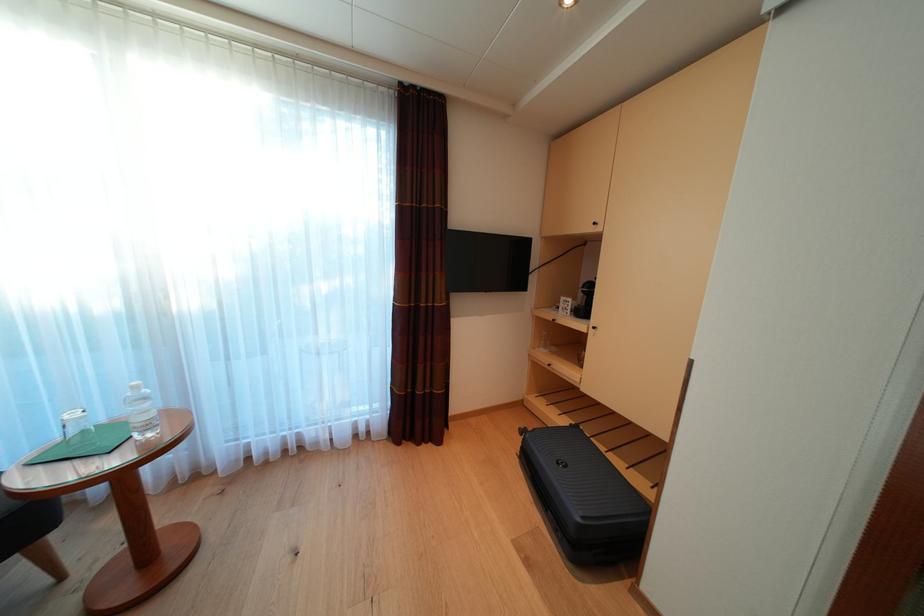
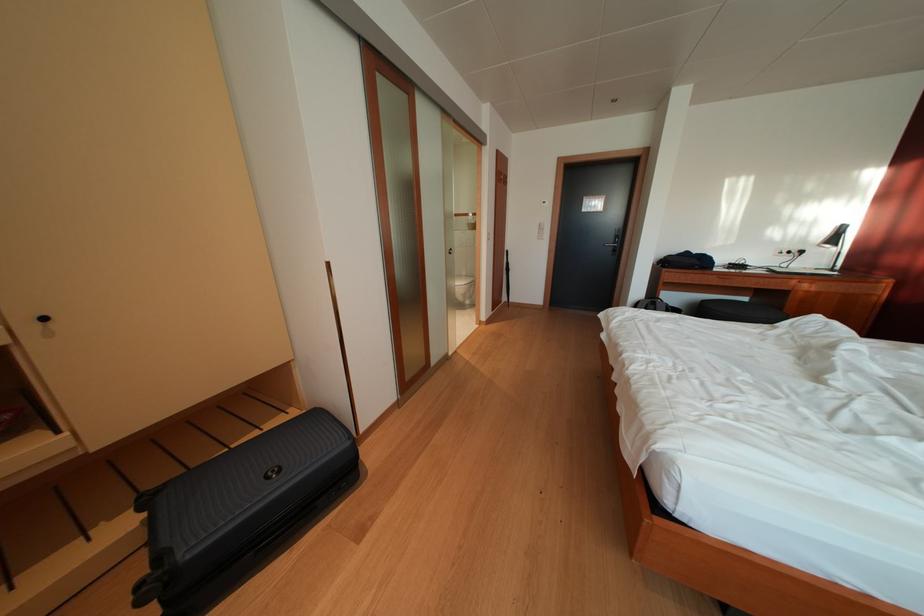
Locate, in the second image, the point that corresponds to pixel 541 436 in the first image.

(167, 562)